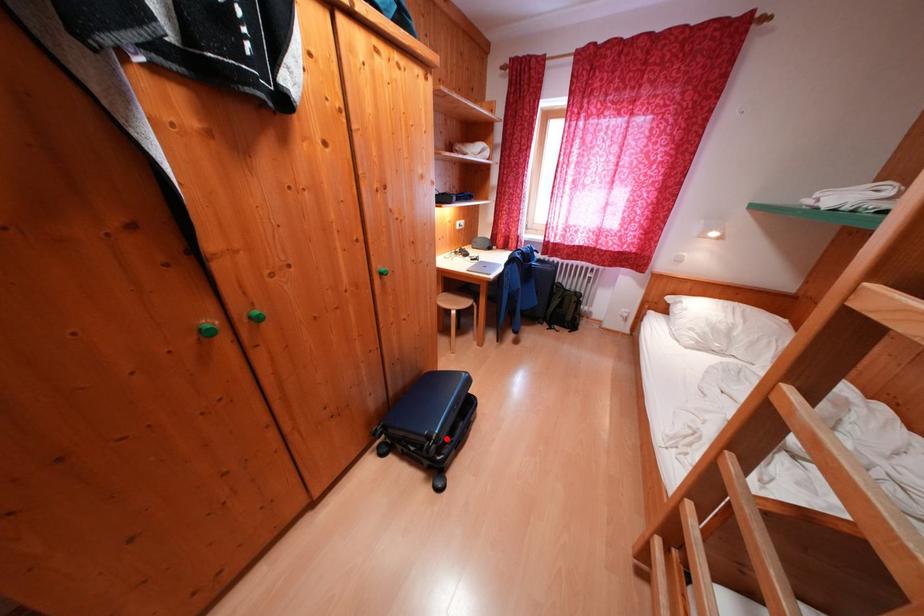
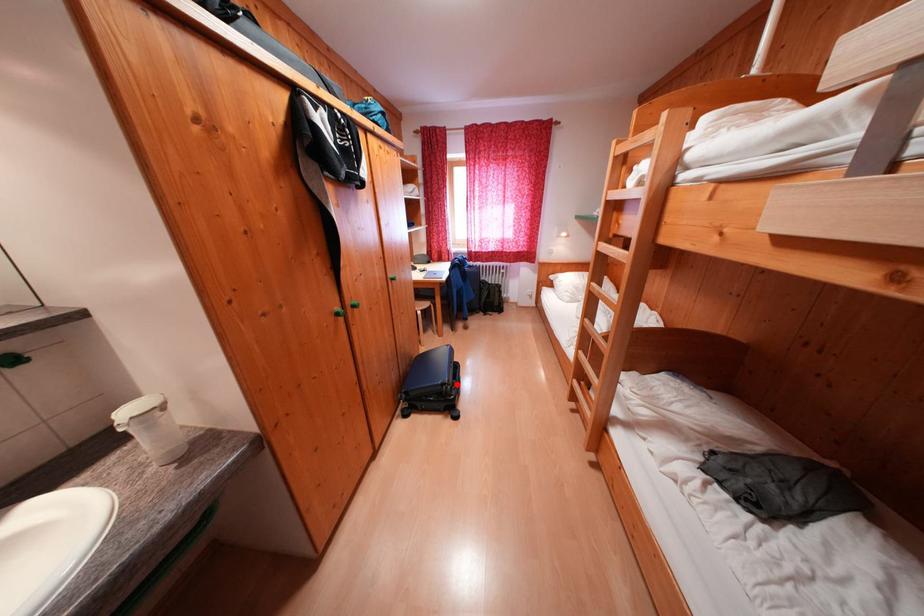
In the scene shown: I am providing you with two images of the same scene from different viewpoints. A red point is marked on the first image and another point is marked on the second image. Is the marked point in image1 the same physical position as the marked point in image2?

Yes